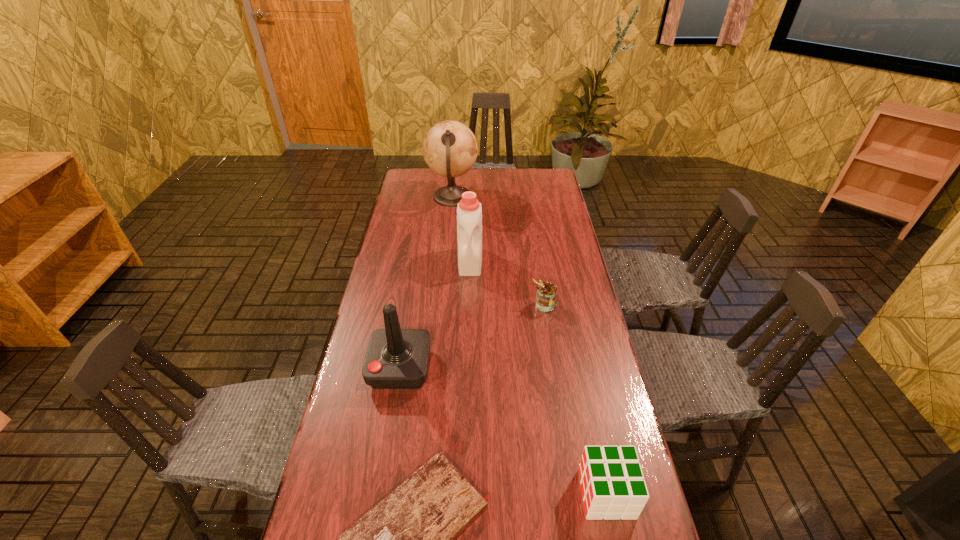
You are a GUI agent. You are given a task and a screenshot of the screen. Output one action in this format:
    pyautogui.click(x=<x>, y=<y>)
    Task: Click on the tallest object
    
    Given the screenshot: What is the action you would take?
    pyautogui.click(x=450, y=149)

Find the location of a particular element. This screenshot has width=960, height=540. the farthest object is located at coordinates (450, 149).

What are the coordinates of `detergent` in the screenshot? It's located at (469, 210).

Identify the location of joystick. This screenshot has height=540, width=960. (396, 358).

Locate an element on the screen. The height and width of the screenshot is (540, 960). can is located at coordinates (546, 292).

Find the location of a particular element. The width and height of the screenshot is (960, 540). cube is located at coordinates (612, 482).

In order to click on free location located 0.090m on the front-facing side of the globe in this screenshot , I will do `click(498, 197)`.

Where is `free location located 0.080m on the handle side of the second farthest object`? Image resolution: width=960 pixels, height=540 pixels. free location located 0.080m on the handle side of the second farthest object is located at coordinates (469, 292).

This screenshot has width=960, height=540. Find the location of `free space located 0.220m on the right of the third nearest object`. free space located 0.220m on the right of the third nearest object is located at coordinates (506, 368).

Locate an element on the screen. The width and height of the screenshot is (960, 540). free space located on the back of the third farthest object is located at coordinates (539, 267).